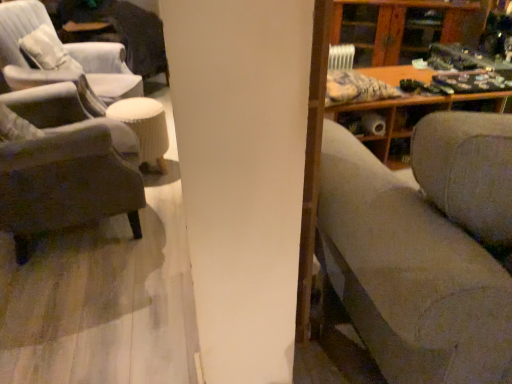
Question: Does textured gray couch at right have a greater height compared to white ribbed stool at center?

Choices:
 (A) no
 (B) yes

Answer: (B)

Question: Does textured gray couch at right have a larger size compared to white ribbed stool at center?

Choices:
 (A) yes
 (B) no

Answer: (A)

Question: Can we say textured gray couch at right lies outside white ribbed stool at center?

Choices:
 (A) no
 (B) yes

Answer: (B)

Question: Is textured gray couch at right aimed at white ribbed stool at center?

Choices:
 (A) yes
 (B) no

Answer: (B)

Question: Is textured gray couch at right positioned far away from white ribbed stool at center?

Choices:
 (A) no
 (B) yes

Answer: (B)

Question: Can you confirm if textured gray couch at right is shorter than white ribbed stool at center?

Choices:
 (A) no
 (B) yes

Answer: (A)

Question: Can you confirm if wooden cabinet at upper right is smaller than velvet gray armchair at left, which is the 2th chair in back-to-front order?

Choices:
 (A) yes
 (B) no

Answer: (A)

Question: From the image's perspective, is wooden cabinet at upper right on top of velvet gray armchair at left, placed as the 1th chair when sorted from front to back?

Choices:
 (A) no
 (B) yes

Answer: (B)

Question: Could you tell me if wooden cabinet at upper right is turned towards velvet gray armchair at left, placed as the 1th chair when sorted from front to back?

Choices:
 (A) no
 (B) yes

Answer: (B)

Question: Can you confirm if wooden cabinet at upper right is positioned to the right of velvet gray armchair at left, which is the 2th chair in back-to-front order?

Choices:
 (A) no
 (B) yes

Answer: (B)

Question: Is wooden cabinet at upper right shorter than velvet gray armchair at left, which is the 2th chair in back-to-front order?

Choices:
 (A) yes
 (B) no

Answer: (A)

Question: Does wooden cabinet at upper right have a greater height compared to velvet gray armchair at left, placed as the 1th chair when sorted from front to back?

Choices:
 (A) no
 (B) yes

Answer: (A)

Question: Does wooden cabinet at upper right appear on the left side of textured gray couch at right?

Choices:
 (A) yes
 (B) no

Answer: (B)